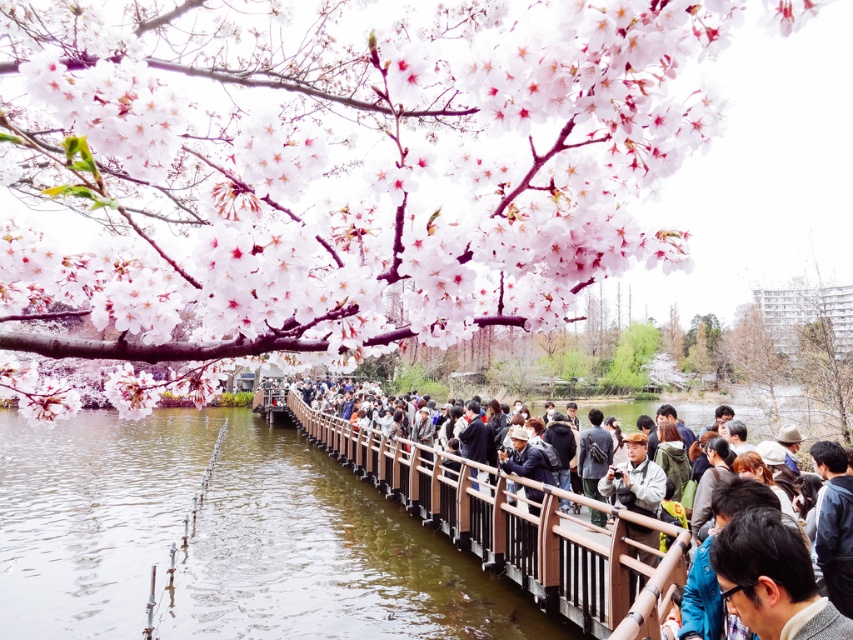
Measure the distance between pink blossoms at upper left and brown wooden rail at center.

They are 22.10 feet apart.

Measure the distance between point (167,141) and camera.

They are 8.21 feet apart.

Identify the location of pink blossoms at upper left. Image resolution: width=853 pixels, height=640 pixels. (338, 168).